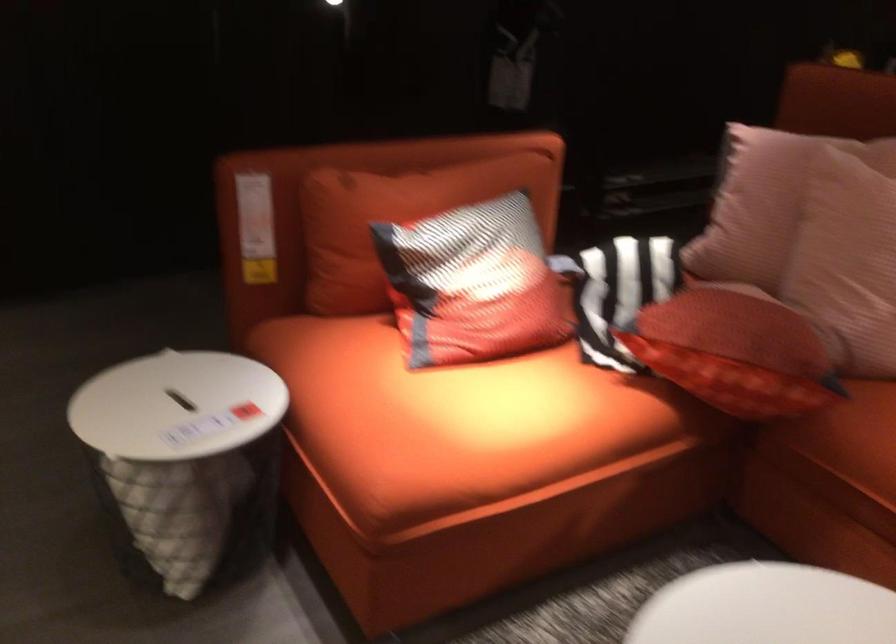
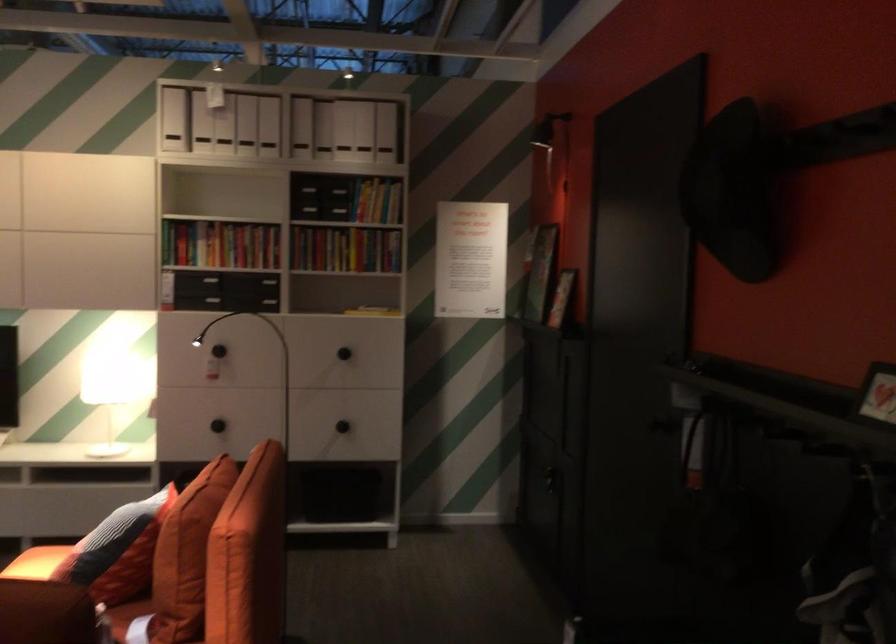
Find the pixel in the second image that matches (x=535, y=230) in the first image.

(117, 551)